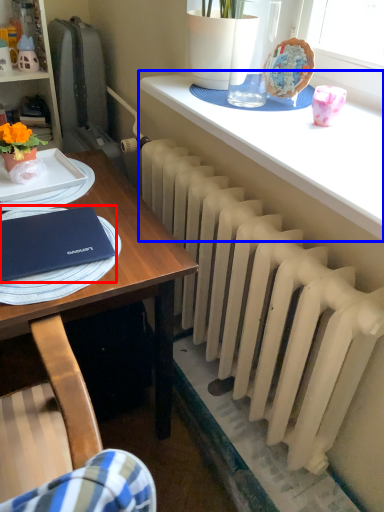
Question: Which object appears closest to the camera in this image, notebook (highlighted by a red box) or table (highlighted by a blue box)?

Choices:
 (A) notebook
 (B) table

Answer: (B)